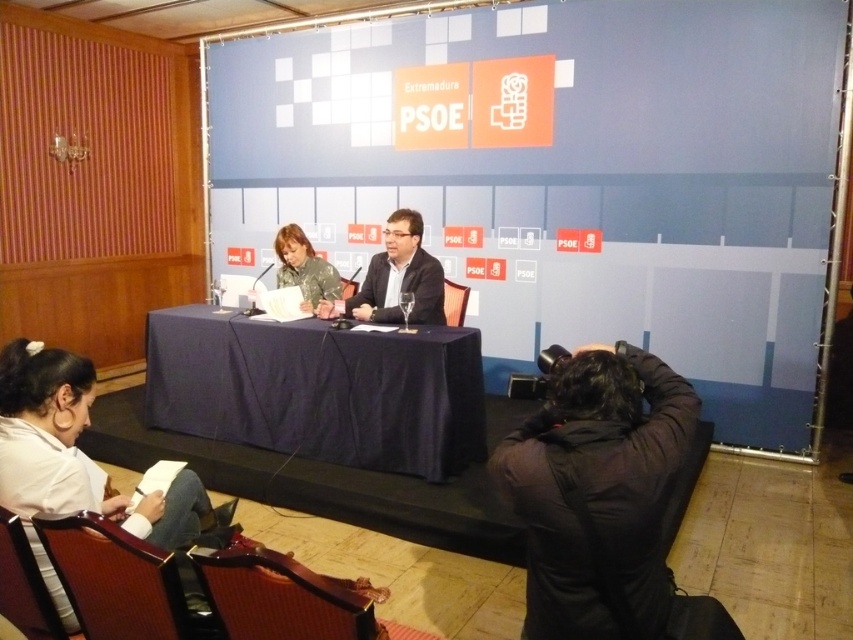
You are organizing a photoshoot and need to ensure that the shirts in the image are arranged properly. The scene has a white fabric shirt at lower left and a camouflage fabric shirt at center. Which shirt should you adjust to make them the same width?

The white fabric shirt at lower left is wider than the camouflage fabric shirt at center. To make them the same width, you should adjust the white fabric shirt at lower left to be narrower or the camouflage fabric shirt at center to be wider.

In the scene shown: You are a photographer standing at the point marked as point (440, 282). You need to take a photo of the two people seated at the table. Considering the distance between them, will you be able to capture both individuals in a single frame without moving your position?

The two people seated at the table are 3.81 meters apart. Since you are positioned at point (440, 282), you should be able to capture both individuals in a single frame as the distance between them is manageable for a standard camera lens without needing to move.